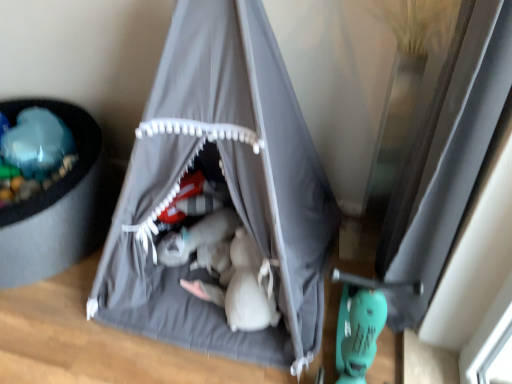
Question: From a real-world perspective, is gray fabric tent at center under transparent glass window at right?

Choices:
 (A) no
 (B) yes

Answer: (A)

Question: Is gray fabric tent at center facing towards transparent glass window at right?

Choices:
 (A) yes
 (B) no

Answer: (B)

Question: From the image's perspective, is gray fabric tent at center above transparent glass window at right?

Choices:
 (A) yes
 (B) no

Answer: (A)

Question: Does gray fabric tent at center have a lesser width compared to transparent glass window at right?

Choices:
 (A) no
 (B) yes

Answer: (A)

Question: Is gray fabric tent at center bigger than transparent glass window at right?

Choices:
 (A) no
 (B) yes

Answer: (B)

Question: Is gray fabric tent at center facing away from transparent glass window at right?

Choices:
 (A) no
 (B) yes

Answer: (A)

Question: Can you confirm if transparent glass window at right is shorter than gray fabric tent at center?

Choices:
 (A) yes
 (B) no

Answer: (A)

Question: Considering the relative positions of transparent glass window at right and gray fabric tent at center in the image provided, is transparent glass window at right behind gray fabric tent at center?

Choices:
 (A) no
 (B) yes

Answer: (B)

Question: From a real-world perspective, is transparent glass window at right over gray fabric tent at center?

Choices:
 (A) yes
 (B) no

Answer: (B)

Question: Is transparent glass window at right taller than gray fabric tent at center?

Choices:
 (A) no
 (B) yes

Answer: (A)

Question: Is transparent glass window at right at the left side of gray fabric tent at center?

Choices:
 (A) no
 (B) yes

Answer: (A)

Question: From the image's perspective, is transparent glass window at right on top of gray fabric tent at center?

Choices:
 (A) yes
 (B) no

Answer: (B)

Question: From a real-world perspective, is gray fabric tent at center physically located above or below transparent glass window at right?

Choices:
 (A) below
 (B) above

Answer: (B)